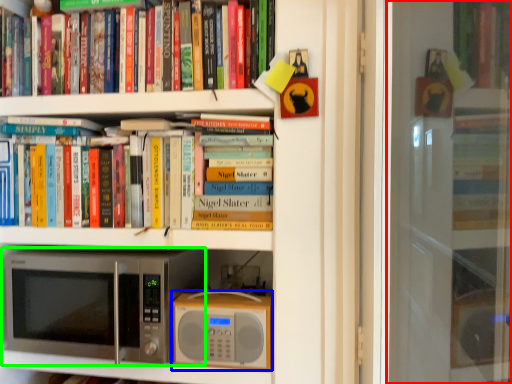
Question: Which is nearer to the screen door (highlighted by a red box)? appliance (highlighted by a blue box) or microwave oven (highlighted by a green box).

Choices:
 (A) appliance
 (B) microwave oven

Answer: (A)